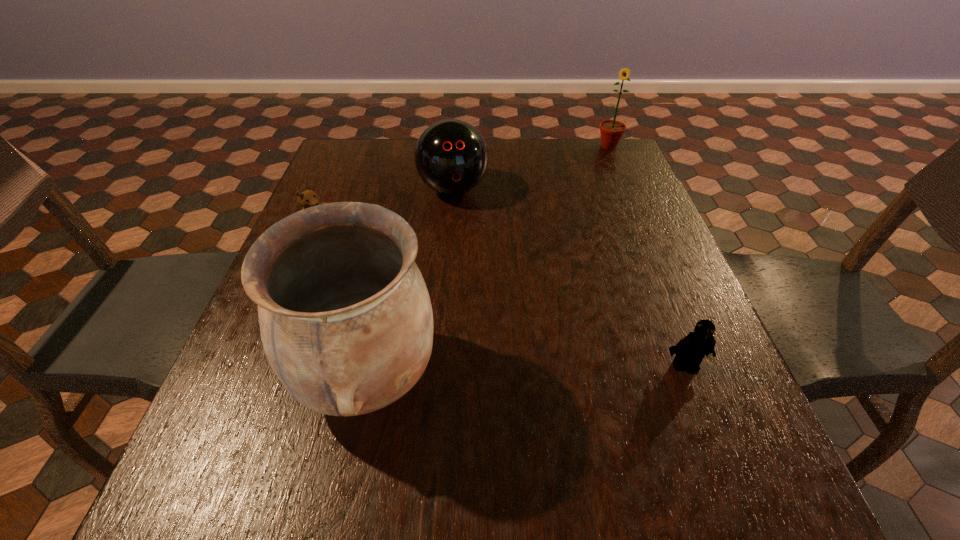
Locate an element on the screen. sunflower that is at the far edge is located at coordinates (611, 131).

Locate an element on the screen. The image size is (960, 540). object present at the near edge is located at coordinates (346, 322).

This screenshot has width=960, height=540. Identify the location of urn that is at the left edge. (346, 322).

Where is `teddy bear that is at the left edge`? teddy bear that is at the left edge is located at coordinates (308, 198).

At what (x,y) coordinates should I click in order to perform the action: click on Lego that is at the right edge. Please return your answer as a coordinate pair (x, y). Looking at the image, I should click on (690, 350).

This screenshot has height=540, width=960. I want to click on sunflower located at the right edge, so click(x=611, y=131).

The height and width of the screenshot is (540, 960). Find the location of `object that is at the near left corner`. object that is at the near left corner is located at coordinates (346, 322).

Where is `object situated at the far right corner`? The width and height of the screenshot is (960, 540). object situated at the far right corner is located at coordinates (611, 131).

Locate an element on the screen. The height and width of the screenshot is (540, 960). free space at the far edge of the desktop is located at coordinates (543, 154).

The height and width of the screenshot is (540, 960). I want to click on blank space at the near edge, so click(x=440, y=420).